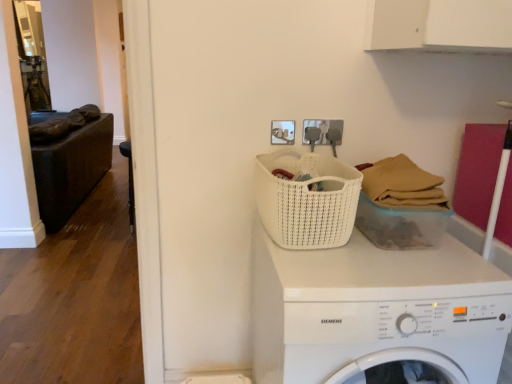
Find the location of a particular element. This screenshot has height=384, width=512. free spot in front of white woven basket at center, which is the second basket in left-to-right order is located at coordinates (413, 272).